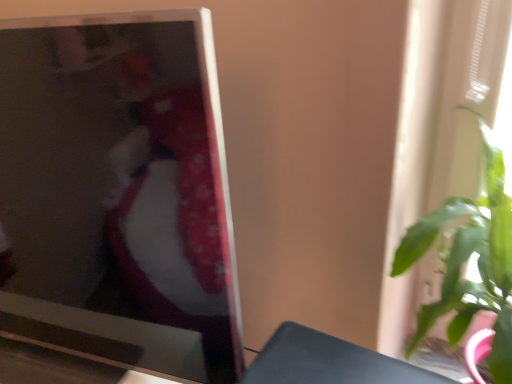
Question: Is green leafy plant at right positioned beyond the bounds of matte black television at left?

Choices:
 (A) yes
 (B) no

Answer: (A)

Question: From the image's perspective, would you say green leafy plant at right is positioned over matte black television at left?

Choices:
 (A) no
 (B) yes

Answer: (A)

Question: Is green leafy plant at right in contact with matte black television at left?

Choices:
 (A) no
 (B) yes

Answer: (A)

Question: Can you confirm if green leafy plant at right is positioned to the right of matte black television at left?

Choices:
 (A) no
 (B) yes

Answer: (B)

Question: Does green leafy plant at right have a lesser width compared to matte black television at left?

Choices:
 (A) yes
 (B) no

Answer: (B)

Question: From the image's perspective, is green leafy plant at right located beneath matte black television at left?

Choices:
 (A) yes
 (B) no

Answer: (A)

Question: From a real-world perspective, is matte black television at left physically below green leafy plant at right?

Choices:
 (A) yes
 (B) no

Answer: (B)

Question: Considering the relative sizes of matte black television at left and green leafy plant at right in the image provided, is matte black television at left bigger than green leafy plant at right?

Choices:
 (A) no
 (B) yes

Answer: (B)

Question: Is matte black television at left positioned before green leafy plant at right?

Choices:
 (A) no
 (B) yes

Answer: (B)

Question: Considering the relative sizes of matte black television at left and green leafy plant at right in the image provided, is matte black television at left smaller than green leafy plant at right?

Choices:
 (A) no
 (B) yes

Answer: (A)

Question: Is matte black television at left oriented towards green leafy plant at right?

Choices:
 (A) yes
 (B) no

Answer: (B)

Question: Is matte black television at left turned away from green leafy plant at right?

Choices:
 (A) no
 (B) yes

Answer: (A)

Question: Is green leafy plant at right to the left or to the right of matte black television at left in the image?

Choices:
 (A) right
 (B) left

Answer: (A)